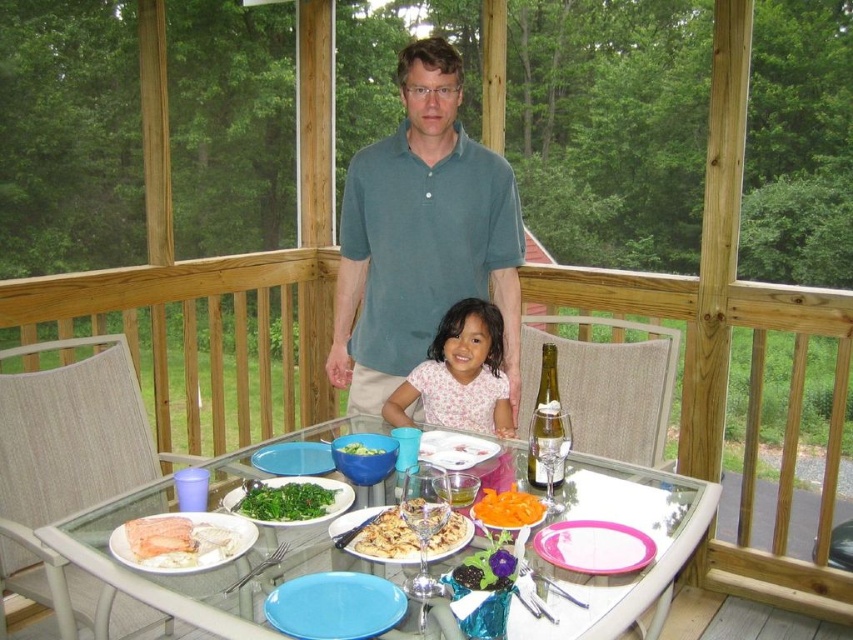
Looking at this image, you are a guest at this outdoor dining event and want to place your napkin on the tallest item between the matte plastic plate at lower center and the orange smoothie at center. Which one should you choose?

The matte plastic plate at lower center is much taller than the orange smoothie at center, so you should place your napkin on the matte plastic plate at lower center.

You are a guest at this outdoor dining event. You want to grab the white matte plate at center but first need to reach the clear glass bottle at table center. Is the bottle blocking your access to the plate?

The clear glass bottle at table center is located above the white matte plate at center, so it is blocking access to the plate. You would need to move the bottle first to reach the plate.